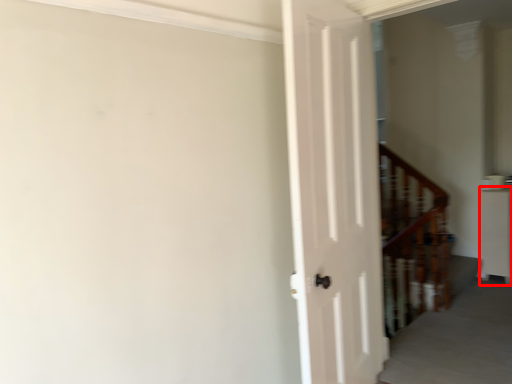
Question: Observing the image, what is the correct spatial positioning of furniture (annotated by the red box) in reference to stairwell?

Choices:
 (A) right
 (B) left

Answer: (A)